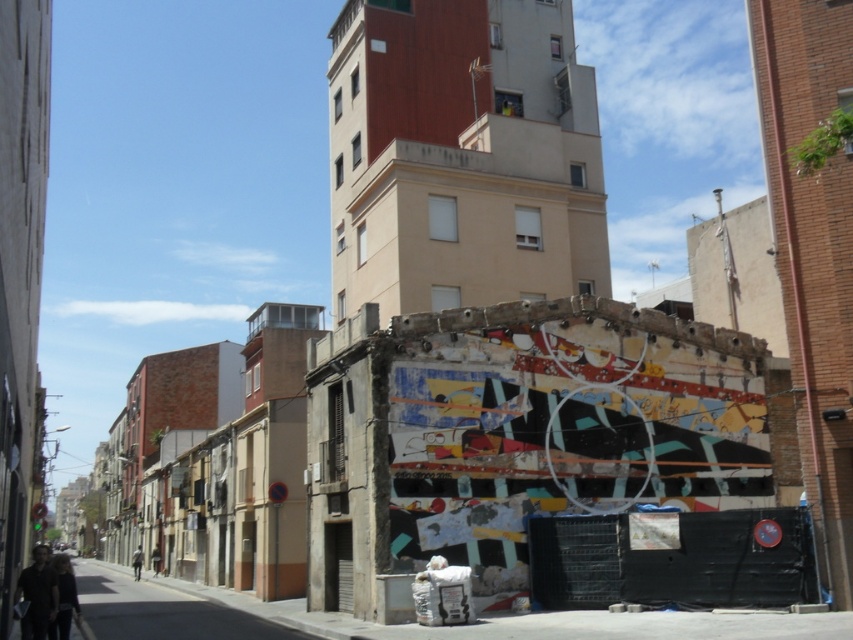
Question: Which point is closer to the camera?

Choices:
 (A) smooth concrete building at upper center
 (B) dark gray fabric jacket at lower left

Answer: (B)

Question: Among these objects, which one is nearest to the camera?

Choices:
 (A) dark gray fabric jacket at lower left
 (B) smooth concrete building at upper center

Answer: (A)

Question: Is smooth concrete building at upper center to the right of dark gray fabric jacket at lower left from the viewer's perspective?

Choices:
 (A) no
 (B) yes

Answer: (B)

Question: Is smooth concrete building at upper center bigger than dark gray fabric jacket at lower left?

Choices:
 (A) no
 (B) yes

Answer: (B)

Question: Is smooth concrete building at upper center smaller than dark gray fabric jacket at lower left?

Choices:
 (A) yes
 (B) no

Answer: (B)